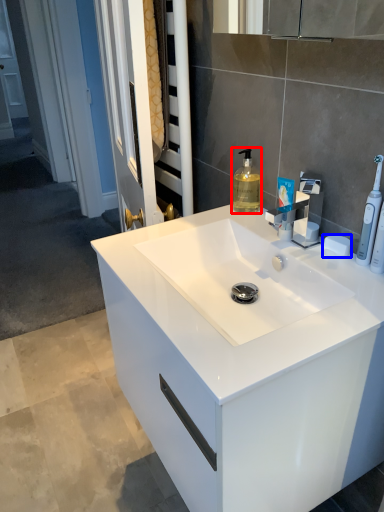
Question: Among these objects, which one is farthest to the camera, soap dispenser (highlighted by a red box) or soap (highlighted by a blue box)?

Choices:
 (A) soap dispenser
 (B) soap

Answer: (A)